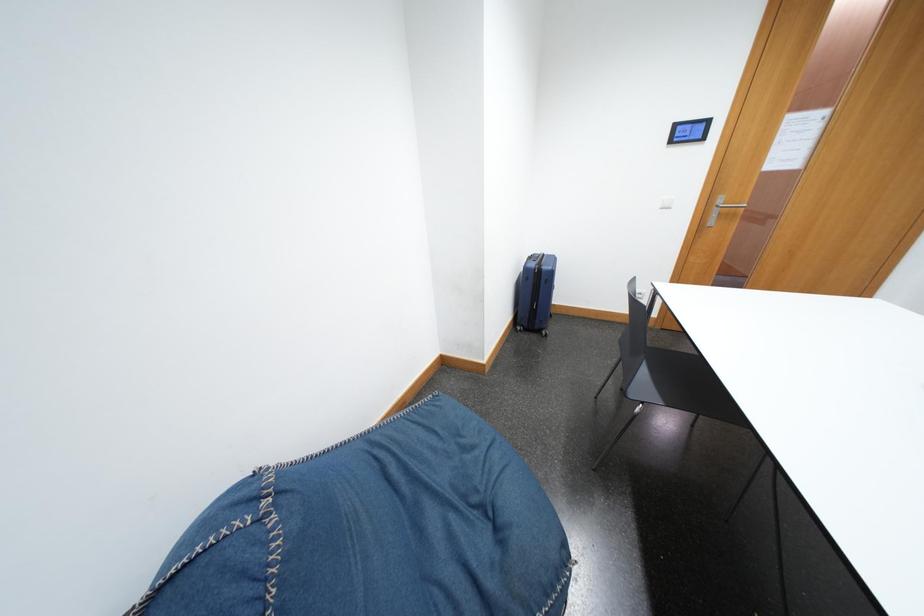
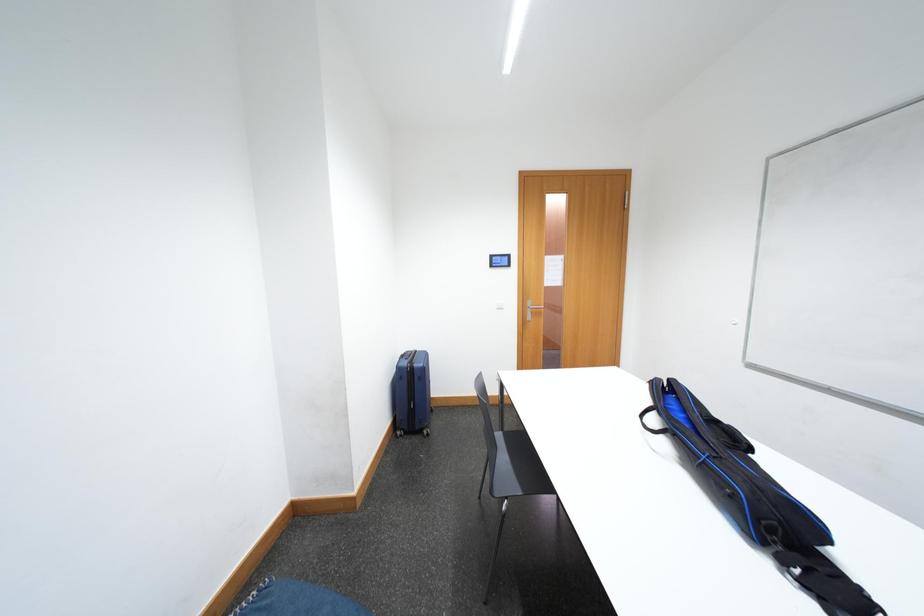
The images are taken continuously from a first-person perspective. In which direction is your viewpoint rotating?

The camera rotated toward right-up.